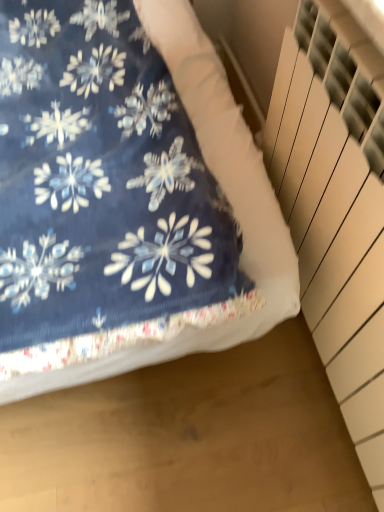
Question: From a real-world perspective, relative to white textured stairwell at right, is navy blue fabric at upper left vertically above or below?

Choices:
 (A) above
 (B) below

Answer: (B)

Question: In the image, is navy blue fabric at upper left on the left side or the right side of white textured stairwell at right?

Choices:
 (A) right
 (B) left

Answer: (B)

Question: From the image's perspective, is navy blue fabric at upper left positioned above or below white textured stairwell at right?

Choices:
 (A) below
 (B) above

Answer: (B)

Question: Is white textured stairwell at right bigger or smaller than navy blue fabric at upper left?

Choices:
 (A) small
 (B) big

Answer: (A)

Question: Is white textured stairwell at right spatially inside navy blue fabric at upper left, or outside of it?

Choices:
 (A) outside
 (B) inside

Answer: (A)

Question: From a real-world perspective, is white textured stairwell at right physically located above or below navy blue fabric at upper left?

Choices:
 (A) above
 (B) below

Answer: (A)

Question: Is point (299, 10) closer or farther from the camera than point (66, 157)?

Choices:
 (A) farther
 (B) closer

Answer: (B)